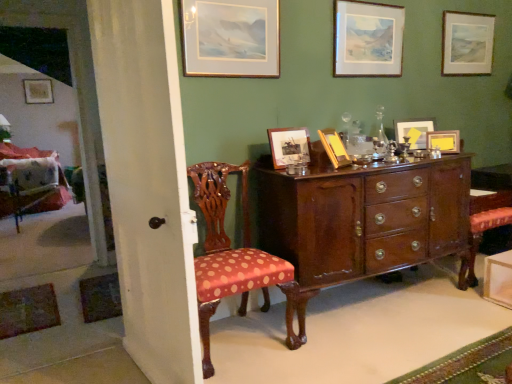
Image resolution: width=512 pixels, height=384 pixels. I want to click on vacant area that is situated to the right of polka dot fabric chair at left, acting as the second chair starting from the back, so click(331, 358).